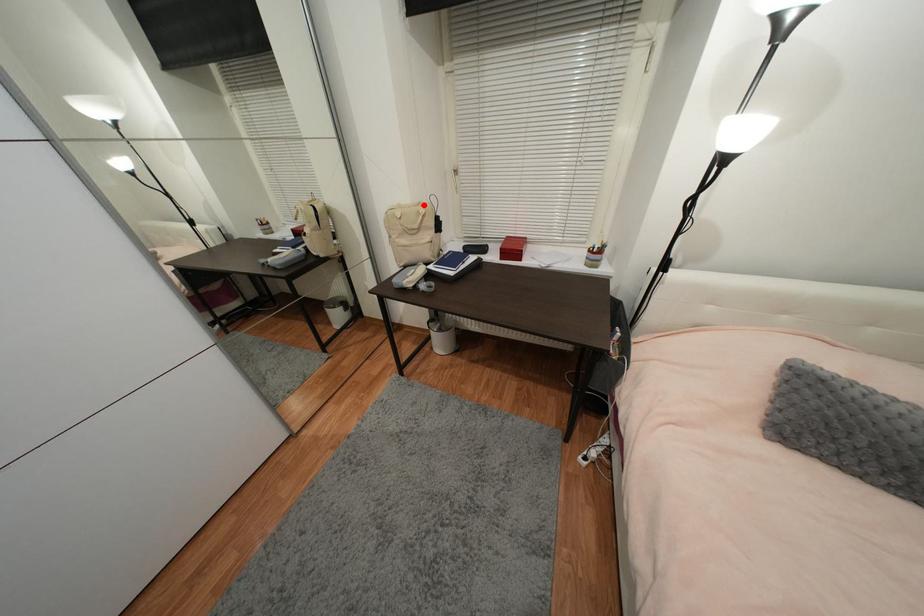
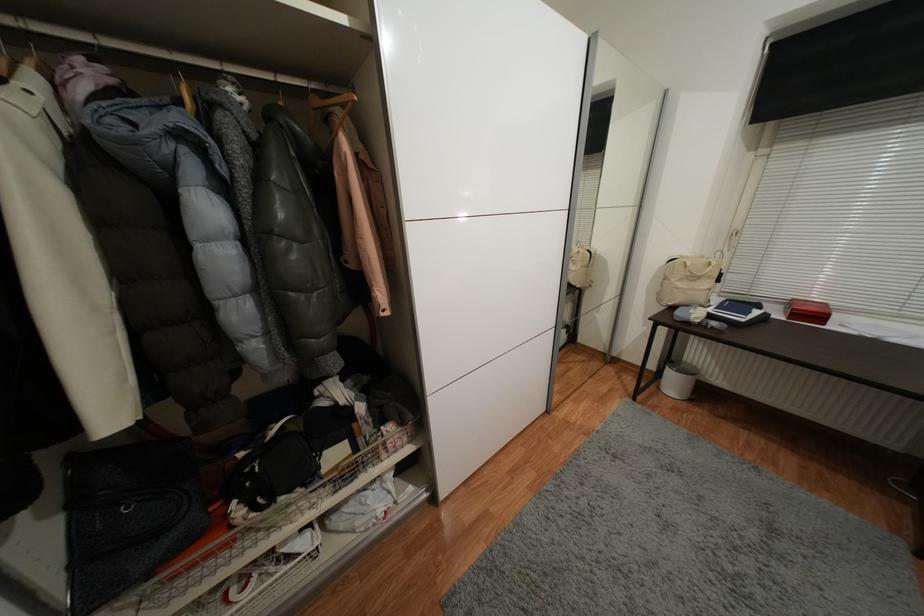
Locate, in the second image, the point that corresponds to the highlighted location in the first image.

(707, 257)